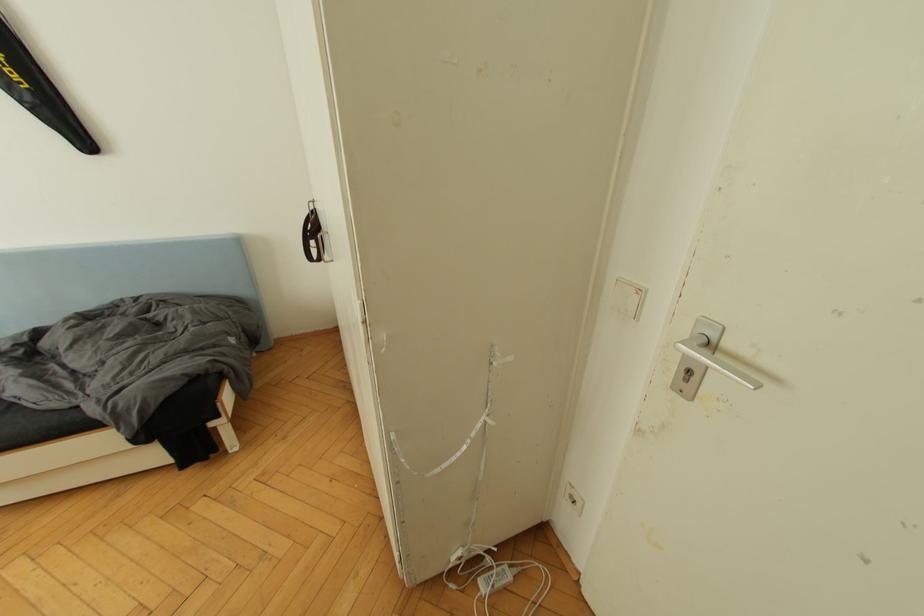
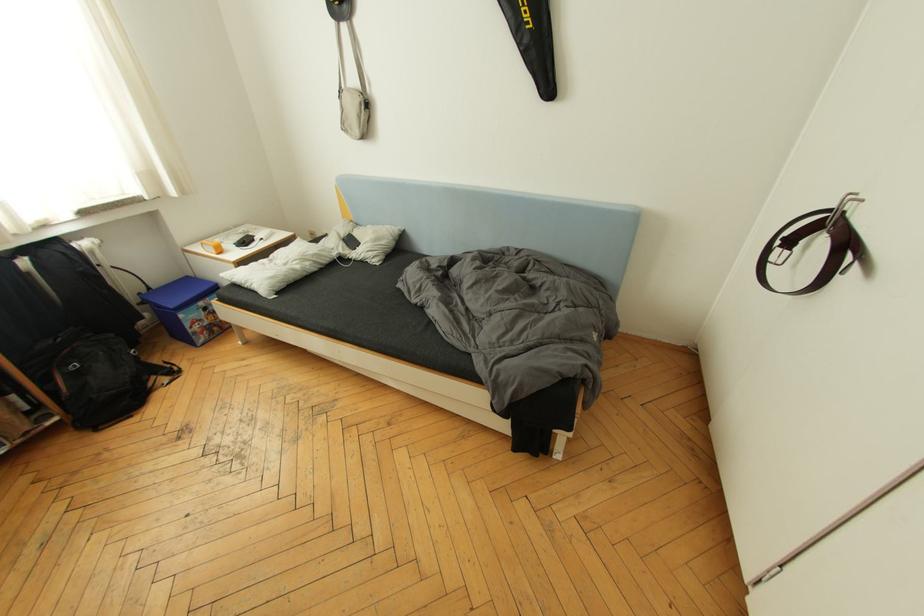
Question: How did the camera likely rotate?

Choices:
 (A) Left
 (B) Right
 (C) Up
 (D) Down

Answer: (A)